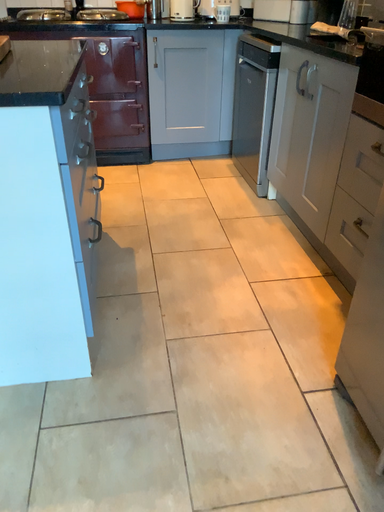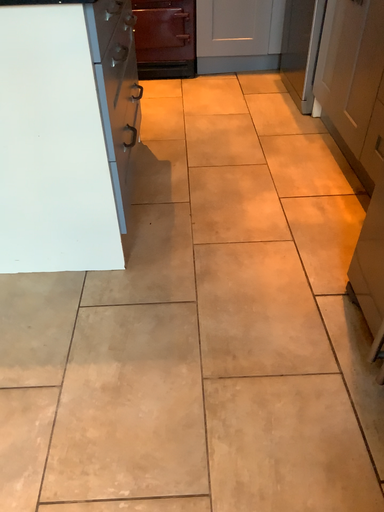
Question: Which way did the camera rotate in the video?

Choices:
 (A) rotated upward
 (B) rotated downward

Answer: (B)